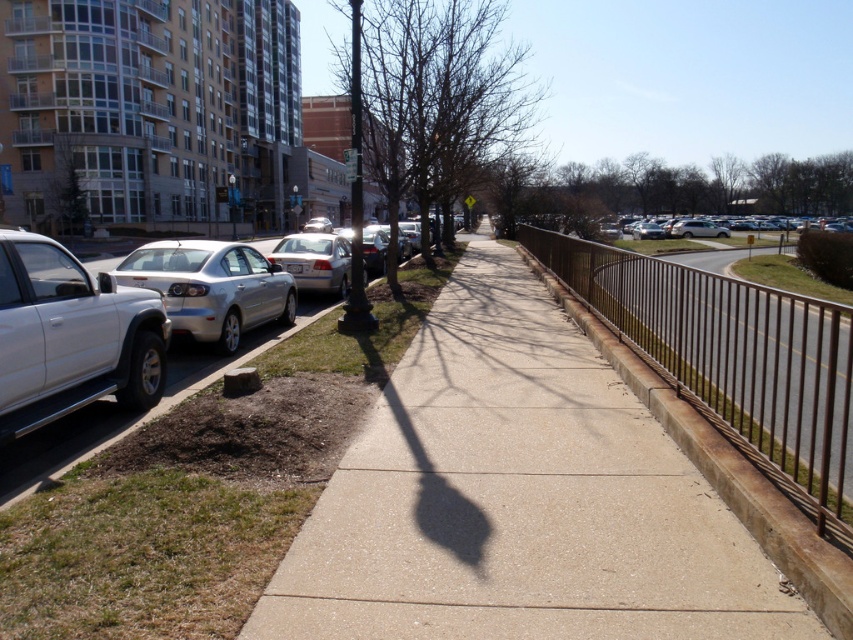
Question: Which point is closer to the camera?

Choices:
 (A) concrete sidewalk at center
 (B) satin silver sedan at left
 (C) silver metallic suv at left

Answer: (A)

Question: Can you confirm if satin silver sedan at left is bigger than satin silver sedan at center?

Choices:
 (A) yes
 (B) no

Answer: (B)

Question: Among these objects, which one is nearest to the camera?

Choices:
 (A) concrete sidewalk at center
 (B) satin silver sedan at left
 (C) silver metallic sedan at right
 (D) satin silver sedan at center

Answer: (A)

Question: Is silver metallic suv at left to the right of satin silver sedan at center from the viewer's perspective?

Choices:
 (A) no
 (B) yes

Answer: (B)

Question: Does satin silver sedan at left appear over satin silver sedan at center?

Choices:
 (A) yes
 (B) no

Answer: (B)

Question: Which of the following is the farthest from the observer?

Choices:
 (A) satin silver sedan at center
 (B) brown metal fence at right

Answer: (A)